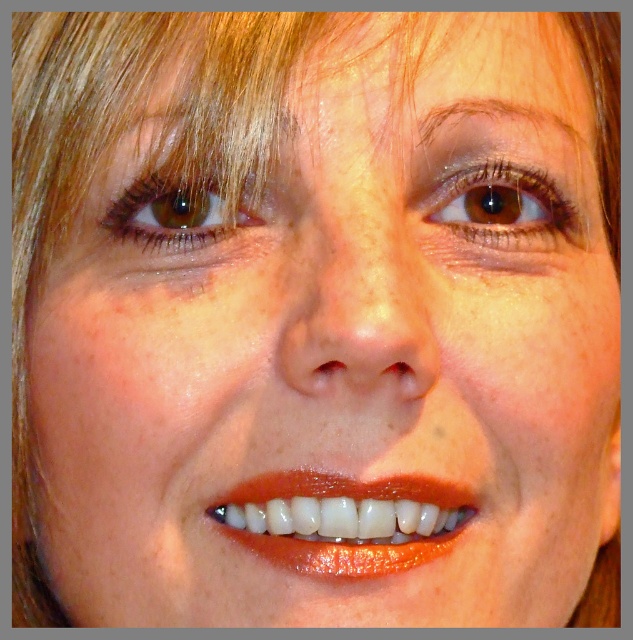
Is brown matte eye at upper center taller than brown matte eye at upper left?

No, brown matte eye at upper center is not taller than brown matte eye at upper left.

Can you confirm if brown matte eye at upper center is positioned below brown matte eye at upper left?

Incorrect, brown matte eye at upper center is not positioned below brown matte eye at upper left.

Does point (558, 225) lie in front of point (197, 211)?

No, (558, 225) is further to viewer.

Where is `brown matte eye at upper center`? This screenshot has height=640, width=633. brown matte eye at upper center is located at coordinates (506, 208).

Is glossy white teeth at center wider than brown matte eye at upper left?

Correct, the width of glossy white teeth at center exceeds that of brown matte eye at upper left.

Measure the distance between point (239, 502) and camera.

Point (239, 502) is 16.89 inches from camera.

Find the location of a particular element. glossy white teeth at center is located at coordinates (346, 522).

Is glossy white teeth at center taller than brown matte eye at upper center?

Indeed, glossy white teeth at center has a greater height compared to brown matte eye at upper center.

Does point (277, 552) come farther from viewer compared to point (561, 204)?

No, (277, 552) is in front of (561, 204).

What do you see at coordinates (346, 522) in the screenshot? The height and width of the screenshot is (640, 633). I see `glossy white teeth at center` at bounding box center [346, 522].

This screenshot has height=640, width=633. Identify the location of glossy white teeth at center. (346, 522).